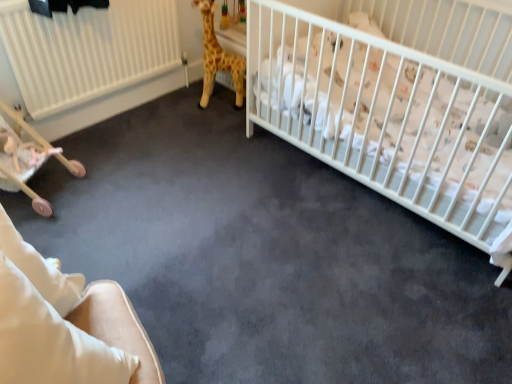
Locate an element on the screen. The height and width of the screenshot is (384, 512). pink plush toy at lower left is located at coordinates 24,152.

What are the coordinates of `beige fabric rocking chair at lower left` in the screenshot? It's located at (65, 323).

Describe the element at coordinates (398, 105) in the screenshot. The height and width of the screenshot is (384, 512). I see `white matte crib at upper right` at that location.

What are the coordinates of `pink plush toy at lower left` in the screenshot? It's located at (24, 152).

Does wooden baby carriage at lower left appear on the left side of beige fabric rocking chair at lower left?

Yes, wooden baby carriage at lower left is to the left of beige fabric rocking chair at lower left.

Is beige fabric rocking chair at lower left located within wooden baby carriage at lower left?

No.

Considering the relative sizes of wooden baby carriage at lower left and beige fabric rocking chair at lower left in the image provided, is wooden baby carriage at lower left shorter than beige fabric rocking chair at lower left?

Yes.

Considering the points (20, 120) and (118, 381), which point is in front, point (20, 120) or point (118, 381)?

The point (118, 381) is in front.

Could white matte crib at upper right be considered to be inside beige fabric rocking chair at lower left?

No, beige fabric rocking chair at lower left does not contain white matte crib at upper right.

From a real-world perspective, which is physically above, beige fabric rocking chair at lower left or white matte crib at upper right?

beige fabric rocking chair at lower left.

Is beige fabric rocking chair at lower left far away from white matte crib at upper right?

beige fabric rocking chair at lower left is far away from white matte crib at upper right.

Which of these two, beige fabric rocking chair at lower left or white matte crib at upper right, is smaller?

With smaller size is beige fabric rocking chair at lower left.

Considering the positions of point (83, 278) and point (24, 190), is point (83, 278) closer or farther from the camera than point (24, 190)?

Clearly, point (83, 278) is closer to the camera than point (24, 190).

Considering the positions of objects beige fabric rocking chair at lower left and wooden baby carriage at lower left in the image provided, who is more to the right, beige fabric rocking chair at lower left or wooden baby carriage at lower left?

Positioned to the right is beige fabric rocking chair at lower left.

Is there a large distance between beige fabric rocking chair at lower left and wooden baby carriage at lower left?

Absolutely, beige fabric rocking chair at lower left is distant from wooden baby carriage at lower left.

Considering the sizes of beige fabric rocking chair at lower left and wooden baby carriage at lower left in the image, is beige fabric rocking chair at lower left taller or shorter than wooden baby carriage at lower left?

Considering their sizes, beige fabric rocking chair at lower left has more height than wooden baby carriage at lower left.

Can we say yellow plush giraffe at upper center lies outside white matte crib at upper right?

Absolutely, yellow plush giraffe at upper center is external to white matte crib at upper right.

How far apart are yellow plush giraffe at upper center and white matte crib at upper right?

The distance of yellow plush giraffe at upper center from white matte crib at upper right is 29.77 inches.

From a real-world perspective, is yellow plush giraffe at upper center below white matte crib at upper right?

Correct, in the physical world, yellow plush giraffe at upper center is lower than white matte crib at upper right.

Would you say yellow plush giraffe at upper center is a long distance from white matte crib at upper right?

No, yellow plush giraffe at upper center is not far from white matte crib at upper right.

Considering their positions, is pink plush toy at lower left located in front of or behind beige fabric rocking chair at lower left?

Clearly, pink plush toy at lower left is behind beige fabric rocking chair at lower left.

Considering the relative positions of pink plush toy at lower left and beige fabric rocking chair at lower left in the image provided, is pink plush toy at lower left to the left or to the right of beige fabric rocking chair at lower left?

From the image, it's evident that pink plush toy at lower left is to the left of beige fabric rocking chair at lower left.

From a real-world perspective, which object rests below the other?

pink plush toy at lower left.

Is pink plush toy at lower left wider than beige fabric rocking chair at lower left?

No, pink plush toy at lower left is not wider than beige fabric rocking chair at lower left.

Is pink plush toy at lower left with wooden baby carriage at lower left?

Yes, pink plush toy at lower left is with wooden baby carriage at lower left.

Can you confirm if pink plush toy at lower left is positioned to the left of wooden baby carriage at lower left?

In fact, pink plush toy at lower left is to the right of wooden baby carriage at lower left.

Does pink plush toy at lower left come behind wooden baby carriage at lower left?

Yes, it is.

Can you confirm if pink plush toy at lower left is thinner than wooden baby carriage at lower left?

Indeed, pink plush toy at lower left has a lesser width compared to wooden baby carriage at lower left.

How different are the orientations of yellow plush giraffe at upper center and beige fabric rocking chair at lower left in degrees?

The angle between the facing direction of yellow plush giraffe at upper center and the facing direction of beige fabric rocking chair at lower left is 93.1 degrees.

Who is more distant, yellow plush giraffe at upper center or beige fabric rocking chair at lower left?

yellow plush giraffe at upper center.

Looking at this image, considering the relative sizes of yellow plush giraffe at upper center and beige fabric rocking chair at lower left in the image provided, is yellow plush giraffe at upper center taller than beige fabric rocking chair at lower left?

Indeed, yellow plush giraffe at upper center has a greater height compared to beige fabric rocking chair at lower left.

Identify the location of giraffe lying behind the beige fabric rocking chair at lower left. Image resolution: width=512 pixels, height=384 pixels. (218, 58).

Locate an element on the screen. The image size is (512, 384). baby carriage directly beneath the beige fabric rocking chair at lower left (from a real-world perspective) is located at coordinates (25, 125).

Identify the location of rocking chair that is on the left side of white matte crib at upper right. This screenshot has width=512, height=384. (65, 323).

Which object lies further to the anchor point wooden baby carriage at lower left, white matte crib at upper right or yellow plush giraffe at upper center?

white matte crib at upper right.

From the image, which object appears to be farther from white matte crib at upper right, pink plush toy at lower left or beige fabric rocking chair at lower left?

Based on the image, pink plush toy at lower left appears to be further to white matte crib at upper right.

Estimate the real-world distances between objects in this image. Which object is closer to white matte crib at upper right, pink plush toy at lower left or yellow plush giraffe at upper center?

yellow plush giraffe at upper center is closer to white matte crib at upper right.

Considering their positions, is white matte crib at upper right positioned further to pink plush toy at lower left than wooden baby carriage at lower left?

The object further to pink plush toy at lower left is white matte crib at upper right.

From the image, which object appears to be nearer to white matte crib at upper right, wooden baby carriage at lower left or pink plush toy at lower left?

wooden baby carriage at lower left lies closer to white matte crib at upper right than the other object.

Estimate the real-world distances between objects in this image. Which object is closer to beige fabric rocking chair at lower left, wooden baby carriage at lower left or white matte crib at upper right?

wooden baby carriage at lower left.

From the picture: Estimate the real-world distances between objects in this image. Which object is further from pink plush toy at lower left, white matte crib at upper right or yellow plush giraffe at upper center?

Among the two, white matte crib at upper right is located further to pink plush toy at lower left.

Considering their positions, is beige fabric rocking chair at lower left positioned closer to pink plush toy at lower left than yellow plush giraffe at upper center?

Among the two, yellow plush giraffe at upper center is located nearer to pink plush toy at lower left.

I want to click on baby carriage positioned between beige fabric rocking chair at lower left and pink plush toy at lower left from near to far, so click(x=25, y=125).

Find the location of `rocking chair located between pink plush toy at lower left and white matte crib at upper right in the left-right direction`. rocking chair located between pink plush toy at lower left and white matte crib at upper right in the left-right direction is located at coordinates (65, 323).

In order to click on rocking chair between wooden baby carriage at lower left and white matte crib at upper right in this screenshot , I will do `click(65, 323)`.

The width and height of the screenshot is (512, 384). What are the coordinates of `infant bed between beige fabric rocking chair at lower left and yellow plush giraffe at upper center from front to back` in the screenshot? It's located at (398, 105).